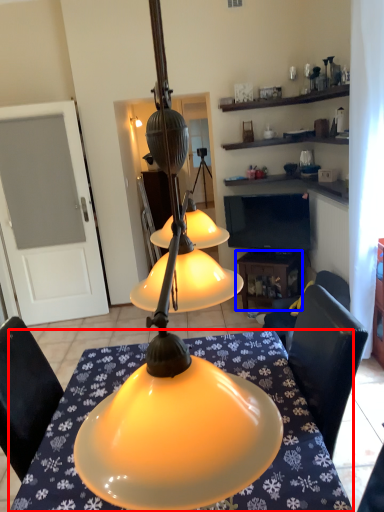
Question: Which object is further to the camera taking this photo, desk (highlighted by a red box) or table (highlighted by a blue box)?

Choices:
 (A) desk
 (B) table

Answer: (B)